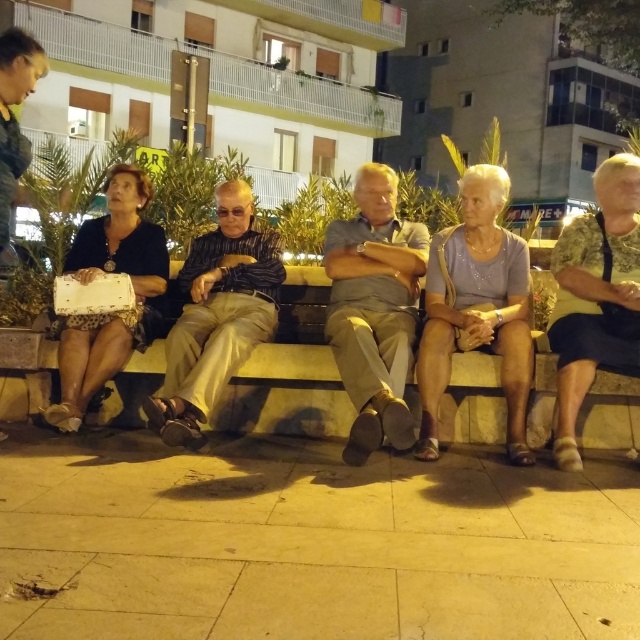
Does stone bench at center have a greater width compared to matte gray blouse at center?

Correct, the width of stone bench at center exceeds that of matte gray blouse at center.

Which of these two, stone bench at center or matte gray blouse at center, stands shorter?

With less height is stone bench at center.

What do you see at coordinates (285, 394) in the screenshot? I see `stone bench at center` at bounding box center [285, 394].

At what (x,y) coordinates should I click in order to perform the action: click on stone bench at center. Please return your answer as a coordinate pair (x, y). The image size is (640, 640). Looking at the image, I should click on (285, 394).

Which is more to the right, matte gray blouse at center or leather black purse at left?

From the viewer's perspective, matte gray blouse at center appears more on the right side.

Does matte gray blouse at center have a smaller size compared to leather black purse at left?

No.

The width and height of the screenshot is (640, 640). I want to click on matte gray blouse at center, so pos(476,307).

Where is `matte gray blouse at center`? matte gray blouse at center is located at coordinates (476, 307).

Is gray cotton shirt at center to the right of matte gray blouse at center from the viewer's perspective?

Incorrect, gray cotton shirt at center is not on the right side of matte gray blouse at center.

Can you confirm if gray cotton shirt at center is positioned above matte gray blouse at center?

Actually, gray cotton shirt at center is below matte gray blouse at center.

Is point (406, 419) positioned before point (508, 298)?

Yes, it is in front of point (508, 298).

Where is `gray cotton shirt at center`? The width and height of the screenshot is (640, 640). gray cotton shirt at center is located at coordinates (374, 310).